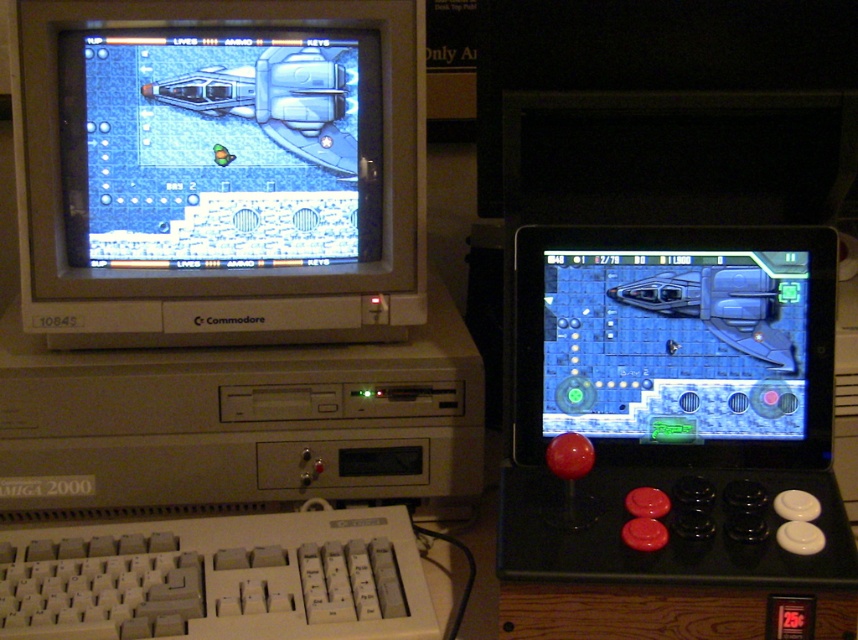
You are setting up a gaming display and need to place a new stand exactly at the coordinates where the matte gray monitor at center is located. What are the coordinates where you should position the stand?

The matte gray monitor at center is located at point (219, 166), so you should position the stand at those coordinates.

You are a gamer trying to reach the white plastic keyboard at lower left on the screen. Based on its coordinates, where exactly is it located?

The white plastic keyboard at lower left is located at point 0.905 on the x axis and 0.255 on the y axis.

Consider the image. You are a technician trying to set up a workstation for a gaming event. You have a matte gray monitor at center and a white plastic keyboard at lower left. The event requires that the keyboard be placed exactly 15 inches away from the monitor. Based on the current setup, is the keyboard positioned correctly?

The matte gray monitor at center and white plastic keyboard at lower left are 14.28 inches apart from each other. Since the required distance is 15 inches, the keyboard is slightly closer than needed and should be moved back about 0.72 inches to meet the requirement.